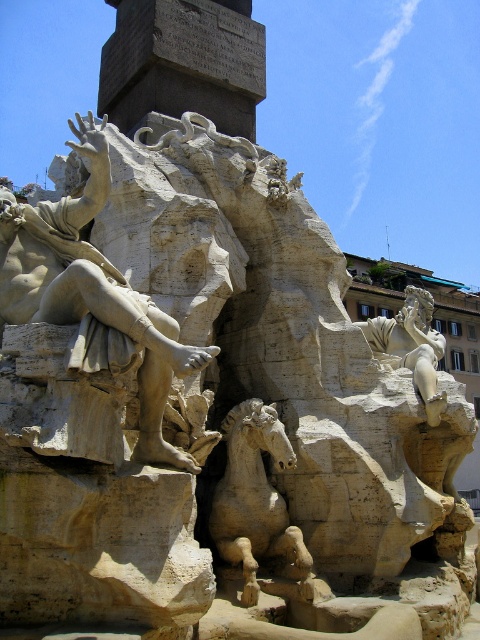
Question: Can you confirm if white stone horse at center is positioned above smooth beige statue at upper right?

Choices:
 (A) no
 (B) yes

Answer: (A)

Question: Can you confirm if white marble statue at left is bigger than smooth beige statue at upper right?

Choices:
 (A) no
 (B) yes

Answer: (A)

Question: Which of the following is the farthest from the observer?

Choices:
 (A) smooth beige statue at upper right
 (B) white marble statue at left

Answer: (A)

Question: Which point is farther to the camera?

Choices:
 (A) smooth beige statue at upper right
 (B) white stone horse at center

Answer: (A)

Question: Observing the image, what is the correct spatial positioning of white marble statue at left in reference to white stone horse at center?

Choices:
 (A) above
 (B) below

Answer: (A)

Question: Which point is closer to the camera?

Choices:
 (A) white stone horse at center
 (B) smooth beige statue at upper right
 (C) white marble statue at left

Answer: (C)